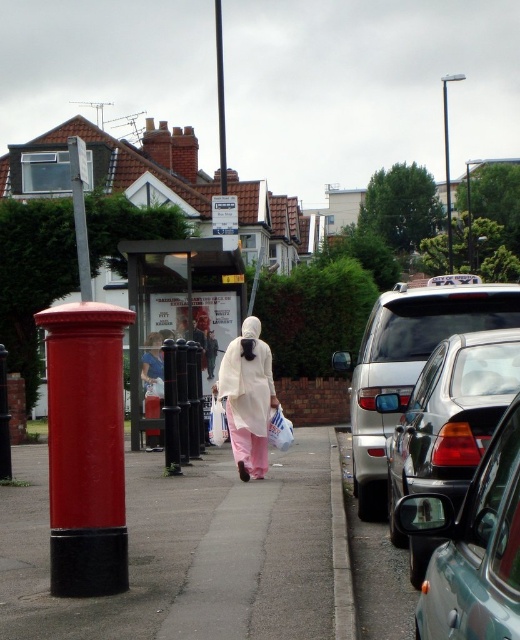
You are a pedestrian standing at the red postbox with a black base on the sidewalk. You want to walk to the bus stop shelter. Which direction should you go to avoid the metallic silver car at right and the light beige fabric at center?

The metallic silver car at right is to the right of the light beige fabric at center. To avoid both, walk towards the left side of the sidewalk where the red postbox is located, ensuring you stay away from the metallic silver car at right and the light beige fabric at center.

You are standing at the camera position and want to cross the street to reach the metallic silver car at right. The road has a speed limit of 30 mph. Is the distance between you and the car sufficient to safely cross the road before any oncoming traffic arrives?

The distance between you and the metallic silver car at right is 7.15 feet. However, this distance does not account for the road width or oncoming traffic speed. To safely cross, you need to ensure you can cross before any vehicles approach. Since the speed limit is 30 mph, it is recommended to wait for a clear gap in traffic before attempting to cross.